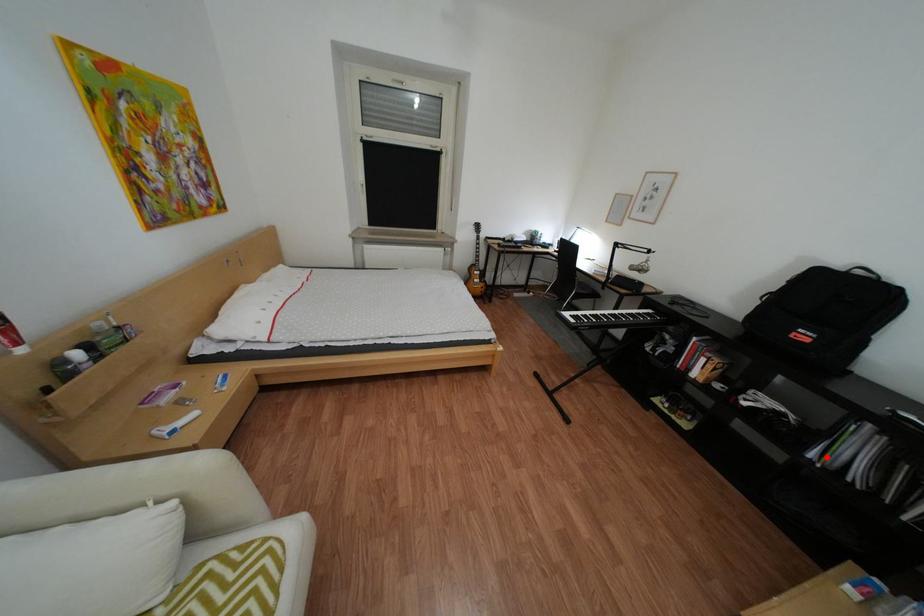
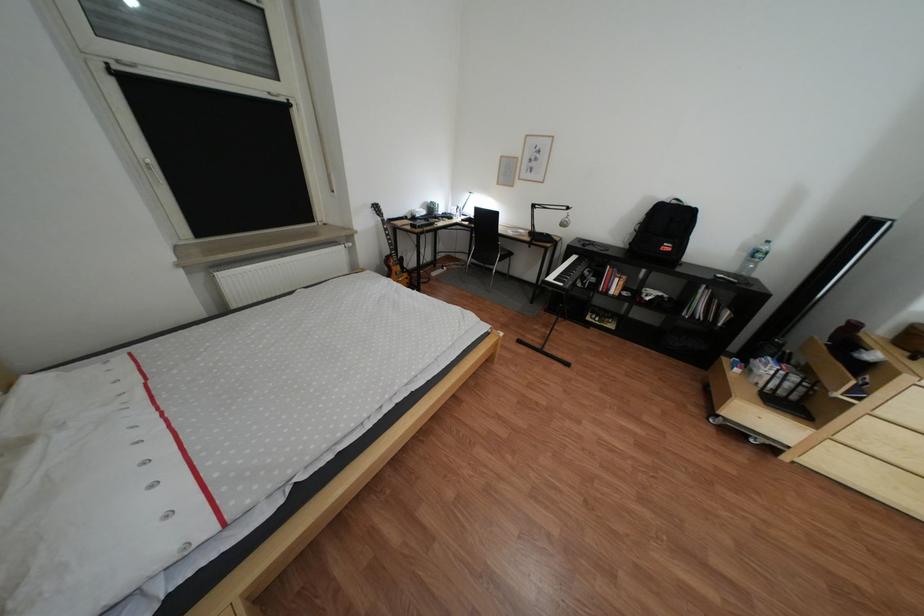
Question: I am providing you with two images of the same scene from different viewpoints. A red point is marked on the first image. Is the red point's position out of view in image 2?

Choices:
 (A) Yes
 (B) No

Answer: (B)